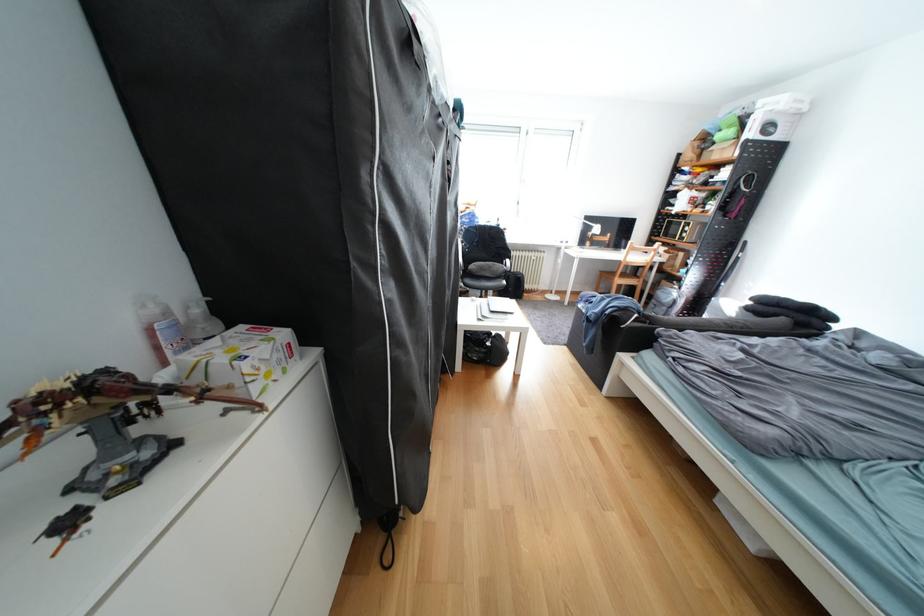
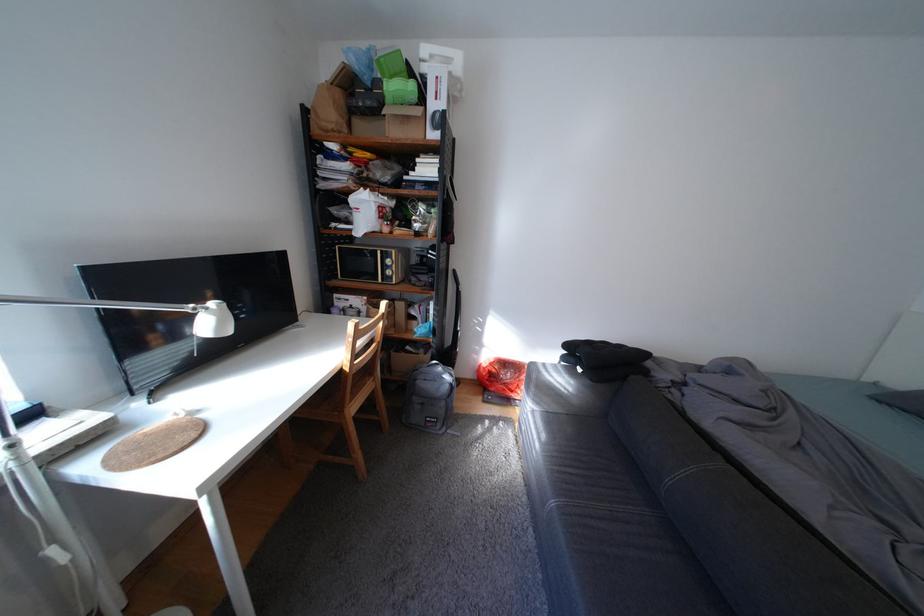
The point at (726,145) is marked in the first image. Where is the corresponding point in the second image?

(395, 103)